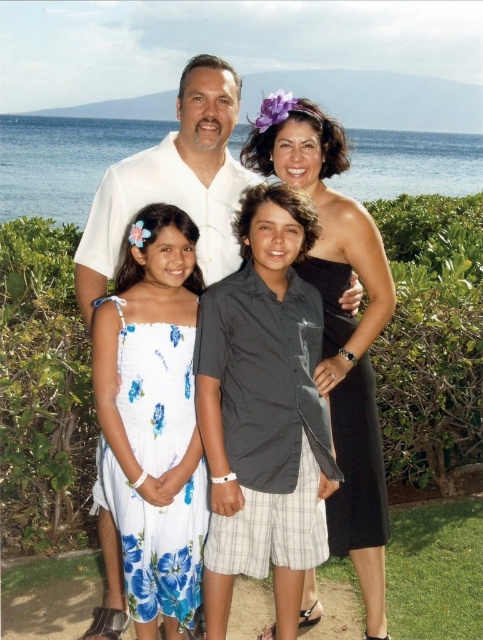
You are a photographer trying to arrange two subjects in a photo. You have the black satin dress at center and the white matte shirt at center. According to the scene, which one should be placed to the right side of the other?

The black satin dress at center should be placed to the right of the white matte shirt at center because the description states that the black satin dress at center is to the right of the white matte shirt at center.

You are a photographer trying to capture a closeup of the dark gray satin shirt at center. Given that your camera can focus on objects within 2 meters, will you need to move closer to the subject?

The dark gray satin shirt at center is 3.62 meters from the camera, which is beyond the camera focus range of 2 meters. Therefore, you will need to move closer to the subject to ensure it is in focus.